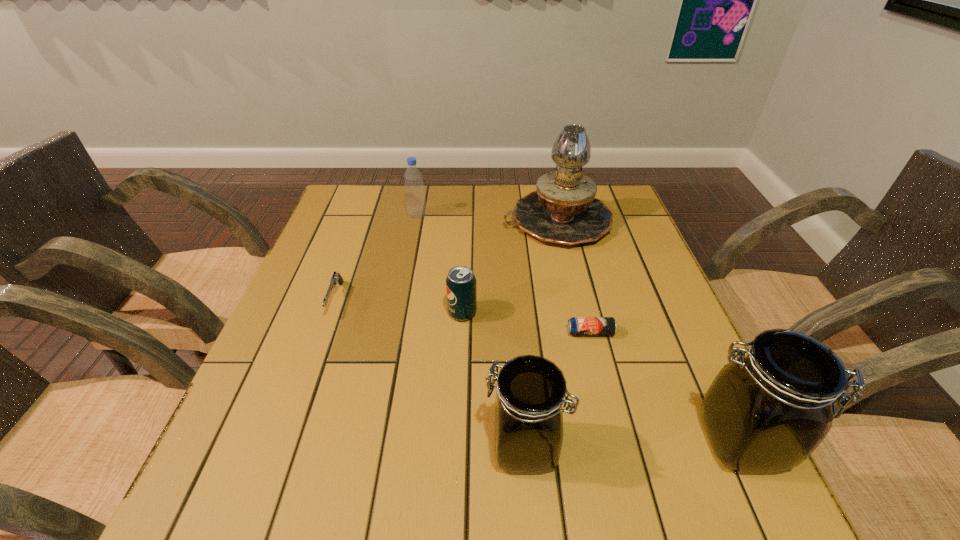
The height and width of the screenshot is (540, 960). What are the coordinates of `the shorter jar` in the screenshot? It's located at (528, 421).

Find the location of a particular element. the taller jar is located at coordinates (766, 412).

Where is `the right jar`? the right jar is located at coordinates coord(766,412).

The image size is (960, 540). I want to click on oil lamp, so click(563, 210).

Identify the location of the sixth object from right to left. This screenshot has height=540, width=960. (415, 197).

At what (x,y) coordinates should I click in order to perform the action: click on the second shortest object. Please return your answer as a coordinate pair (x, y). The width and height of the screenshot is (960, 540). Looking at the image, I should click on (336, 279).

This screenshot has width=960, height=540. I want to click on pistol, so tap(336, 279).

Find the location of a particular element. This screenshot has width=960, height=540. the third shortest object is located at coordinates [x=461, y=290].

Identify the location of soda can. This screenshot has width=960, height=540. (461, 290).

Identify the location of beer can. The height and width of the screenshot is (540, 960). (577, 326).